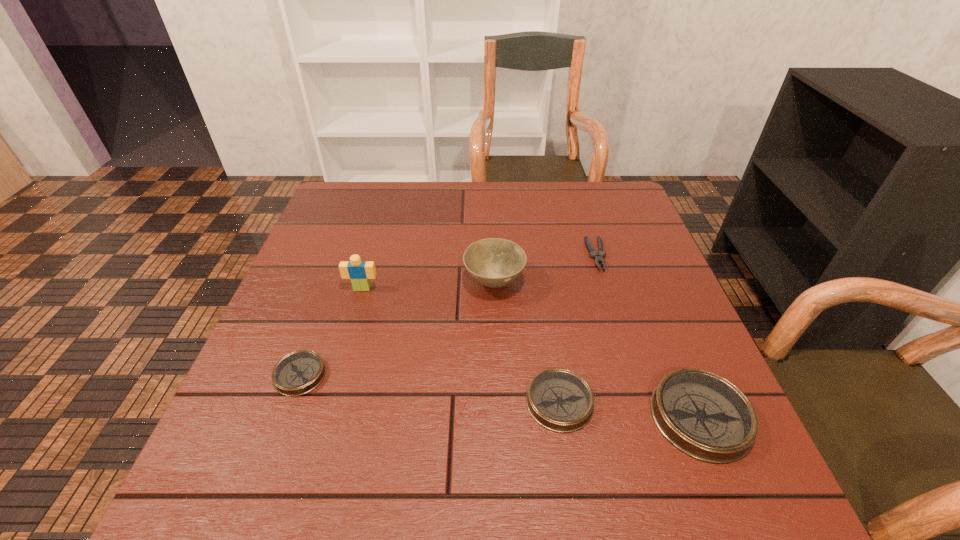
Identify the location of free space at the far edge of the desktop. The image size is (960, 540). (488, 192).

Where is `vacant position at the left edge of the desktop`? Image resolution: width=960 pixels, height=540 pixels. vacant position at the left edge of the desktop is located at coordinates (313, 395).

The height and width of the screenshot is (540, 960). What are the coordinates of `vacant position at the right edge of the desktop` in the screenshot? It's located at (645, 255).

In the image, there is a desktop. At what (x,y) coordinates should I click in order to perform the action: click on free region at the far right corner. Please return your answer as a coordinate pair (x, y). This screenshot has height=540, width=960. Looking at the image, I should click on (625, 190).

Locate an element on the screen. Image resolution: width=960 pixels, height=540 pixels. blank region between the bowl and the pliers is located at coordinates (545, 268).

The image size is (960, 540). I want to click on empty location between the second tallest compass and the bowl, so click(x=527, y=342).

What are the coordinates of `free spot between the second compass from left to right and the bowl` in the screenshot? It's located at (527, 342).

Image resolution: width=960 pixels, height=540 pixels. I want to click on free space between the second tallest object and the Lego, so click(x=428, y=285).

Identify the location of vacant space that is in between the tallest object and the tallest compass. This screenshot has height=540, width=960. (531, 353).

This screenshot has height=540, width=960. In order to click on free spot between the bowl and the Lego in this screenshot , I will do `click(428, 285)`.